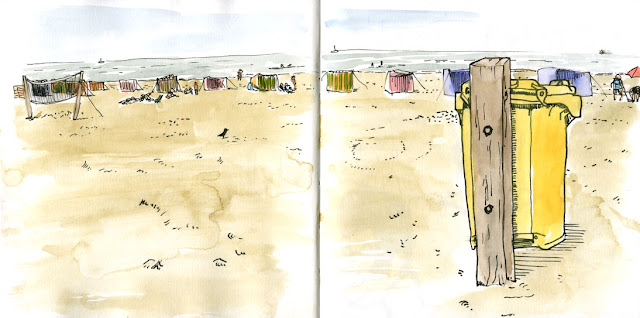
I want to click on trash can, so click(543, 192).